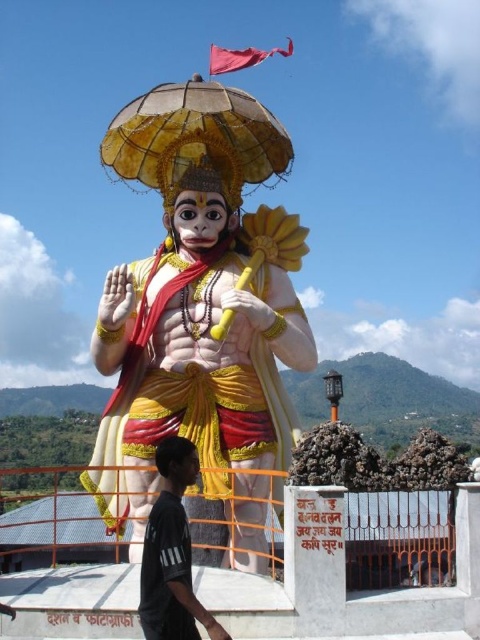
You are an art student analyzing the statue of Hanuman. You notice the polished gold statue at center and the gold textured umbrella at center. Which object appears larger in the image?

The gold textured umbrella at center appears larger than the polished gold statue at center.

You are a photographer standing at the base of the Hanuman statue. You notice two points marked on the statue at coordinates point (239,90) and point (156,534). Which point is closer to your camera position?

Point (239,90) is further to the camera than point (156,534), so the point closer to the camera is point (156,534).

You are an art student analyzing the statue of Hanuman. You notice a specific point at coordinates point (195, 140) on the image. Based on the statue description, what object is located at this point?

The point (195, 140) corresponds to the gold textured umbrella at center.